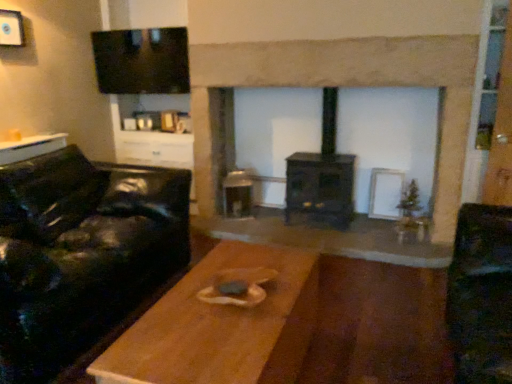
Question: Should I look upward or downward to see white matte picture frame at upper left?

Choices:
 (A) up
 (B) down

Answer: (A)

Question: Does white matte picture frame at upper left lie in front of black leather couch at left?

Choices:
 (A) no
 (B) yes

Answer: (A)

Question: Can you confirm if white matte picture frame at upper left is smaller than black leather couch at left?

Choices:
 (A) yes
 (B) no

Answer: (A)

Question: Is white matte picture frame at upper left facing away from black leather couch at left?

Choices:
 (A) yes
 (B) no

Answer: (B)

Question: Does white matte picture frame at upper left appear on the left side of black leather couch at left?

Choices:
 (A) no
 (B) yes

Answer: (B)

Question: Considering the relative sizes of white matte picture frame at upper left and black leather couch at left in the image provided, is white matte picture frame at upper left shorter than black leather couch at left?

Choices:
 (A) no
 (B) yes

Answer: (B)

Question: Is white matte picture frame at upper left not near black leather couch at left?

Choices:
 (A) yes
 (B) no

Answer: (A)

Question: Is wooden table at left, which is the first table from back to front, beside dark wood fireplace at center?

Choices:
 (A) no
 (B) yes

Answer: (A)

Question: Can you confirm if wooden table at left, which is the first table from back to front, is bigger than dark wood fireplace at center?

Choices:
 (A) no
 (B) yes

Answer: (A)

Question: Is wooden table at left, acting as the first table starting from the left, positioned before dark wood fireplace at center?

Choices:
 (A) no
 (B) yes

Answer: (A)

Question: From the image's perspective, is wooden table at left, which appears as the second table when ordered from the bottom, above dark wood fireplace at center?

Choices:
 (A) yes
 (B) no

Answer: (B)

Question: Is wooden table at left, the second table positioned from the front, further to the viewer compared to dark wood fireplace at center?

Choices:
 (A) no
 (B) yes

Answer: (B)

Question: From the image's perspective, is wooden table at left, which is the second table in right-to-left order, below dark wood fireplace at center?

Choices:
 (A) no
 (B) yes

Answer: (B)

Question: Is wooden table at center, which is the second table from top to bottom, wider than wooden table at left, acting as the first table starting from the left?

Choices:
 (A) no
 (B) yes

Answer: (B)